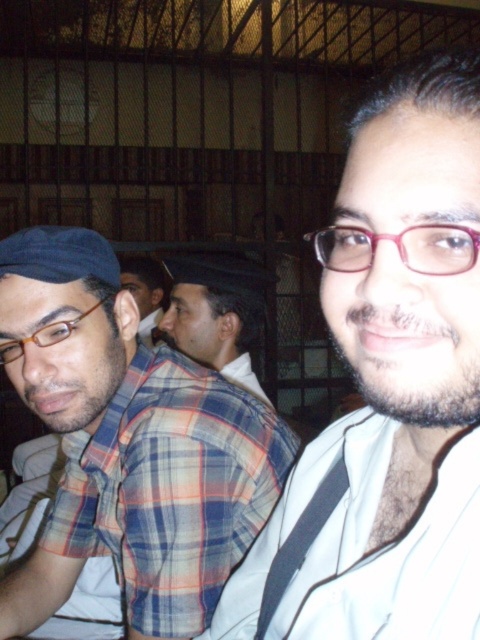
You are at a party and want to grab a drink. You see the pink plastic glasses at center and the matte brown glasses at left. Which glasses are positioned to the right side?

The pink plastic glasses at center are positioned to the right of the matte brown glasses at left.

You are standing in the industrial space depicted in the scene. Where is the plaid fabric shirt at left located in terms of coordinates?

The plaid fabric shirt at left is located at coordinates point (170, 488).

You are standing in the industrial space and want to place a small sensor at the point closer to you between the two points, point (247, 529) and point (137, 330). Which point should you choose?

Point (247, 529) is closer to the camera than point (137, 330), so you should choose point (247, 529) to place the sensor.